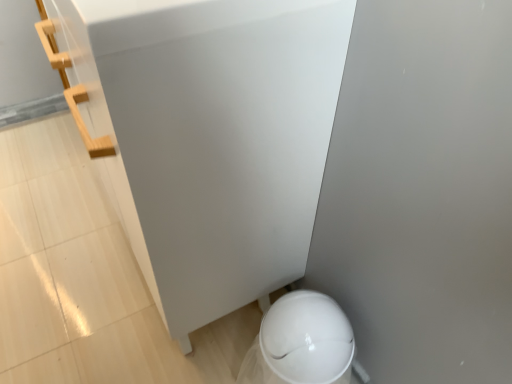
This screenshot has width=512, height=384. I want to click on blank area to the left of white glossy toilet at lower right, so click(216, 352).